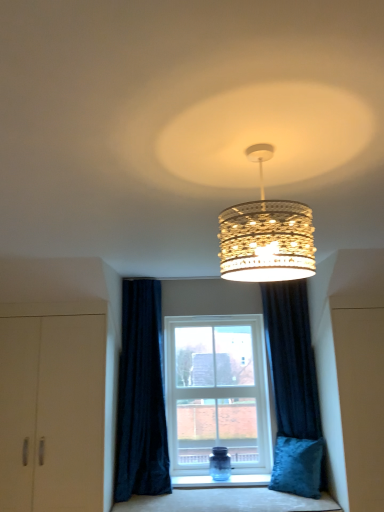
Question: Considering the relative sizes of gold textured chandelier at center and velvet blue cushion at lower center in the image provided, is gold textured chandelier at center thinner than velvet blue cushion at lower center?

Choices:
 (A) yes
 (B) no

Answer: (A)

Question: Is gold textured chandelier at center wider than velvet blue cushion at lower center?

Choices:
 (A) yes
 (B) no

Answer: (B)

Question: Is gold textured chandelier at center at the right side of velvet blue cushion at lower center?

Choices:
 (A) yes
 (B) no

Answer: (B)

Question: Does gold textured chandelier at center have a smaller size compared to velvet blue cushion at lower center?

Choices:
 (A) no
 (B) yes

Answer: (B)

Question: Considering the relative positions of gold textured chandelier at center and velvet blue cushion at lower center in the image provided, is gold textured chandelier at center behind velvet blue cushion at lower center?

Choices:
 (A) yes
 (B) no

Answer: (B)

Question: Is gold textured chandelier at center next to velvet blue cushion at lower center and touching it?

Choices:
 (A) no
 (B) yes

Answer: (A)

Question: From a real-world perspective, is gold textured chandelier at center physically below velvet blue pillow at lower right?

Choices:
 (A) no
 (B) yes

Answer: (A)

Question: Does gold textured chandelier at center have a larger size compared to velvet blue pillow at lower right?

Choices:
 (A) yes
 (B) no

Answer: (B)

Question: Is gold textured chandelier at center with velvet blue pillow at lower right?

Choices:
 (A) no
 (B) yes

Answer: (A)

Question: Is gold textured chandelier at center to the left of velvet blue pillow at lower right from the viewer's perspective?

Choices:
 (A) yes
 (B) no

Answer: (A)

Question: Does gold textured chandelier at center lie in front of velvet blue pillow at lower right?

Choices:
 (A) no
 (B) yes

Answer: (B)

Question: Is gold textured chandelier at center not near velvet blue pillow at lower right?

Choices:
 (A) no
 (B) yes

Answer: (B)

Question: From the image's perspective, is matte beige cabinet at left over velvet blue cushion at lower center?

Choices:
 (A) yes
 (B) no

Answer: (A)